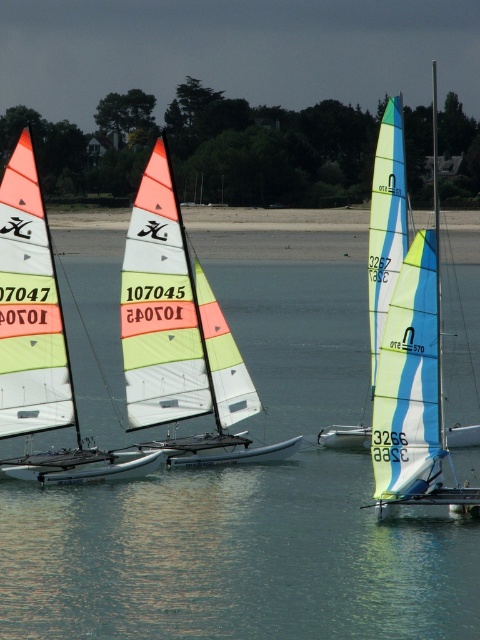
You are standing at point (191, 547) and want to reach a boat that is 23.82 meters away. Can you estimate how far you are from the boat?

You are 23.82 meters away from the boat.

You are a photographer trying to capture the reflection of the matte white sailboat at center in the transparent water at center. Based on the scene description, can you confirm if the reflection will be fully visible in the water?

The transparent water at center is taller than the matte white sailboat at center, so the reflection of the matte white sailboat at center will be fully visible in the transparent water at center.

From the picture: You are a spectator standing on the beach watching the sailboats. You see the matte white sailboat at center and the white glossy sailboat at left. Which boat is closer to the right edge of the water?

The matte white sailboat at center is positioned on the right side of the white glossy sailboat at left, so the matte white sailboat at center is closer to the right edge of the water.